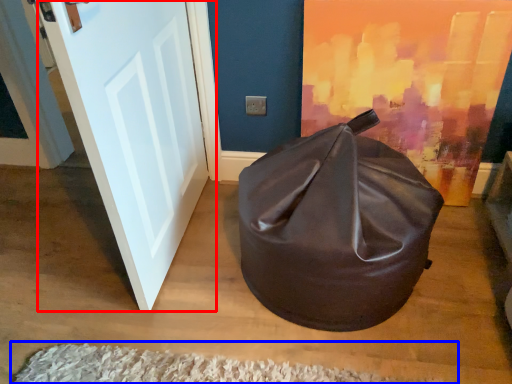
Question: Which object is closer to the camera taking this photo, door (highlighted by a red box) or doormat (highlighted by a blue box)?

Choices:
 (A) door
 (B) doormat

Answer: (A)